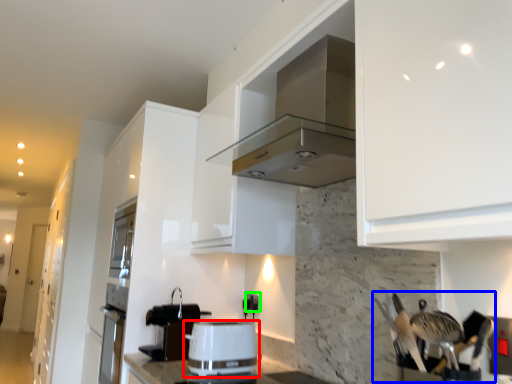
Question: Estimate the real-world distances between objects in this image. Which object is farther from kitchen appliance (highlighted by a red box), silverware (highlighted by a blue box) or electric outlet (highlighted by a green box)?

Choices:
 (A) silverware
 (B) electric outlet

Answer: (A)